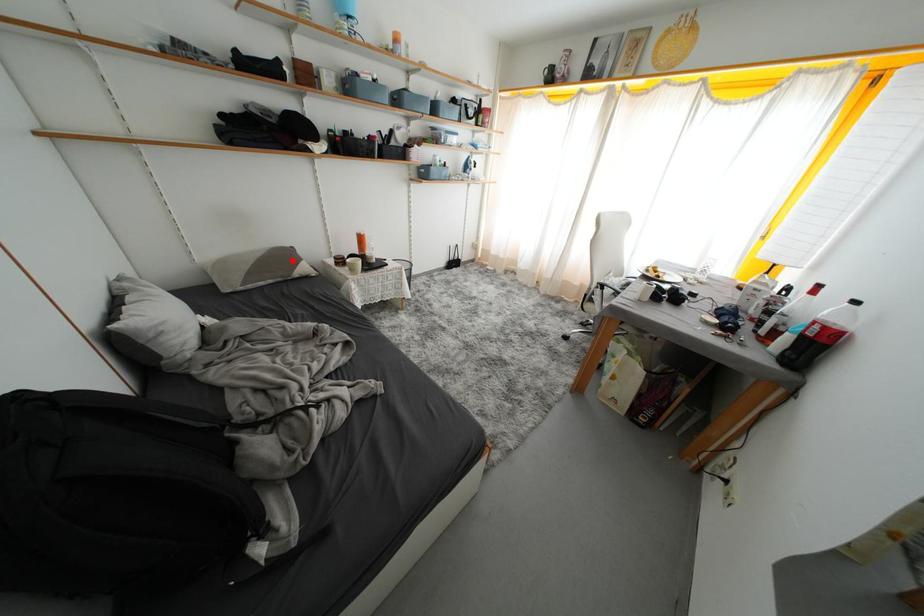
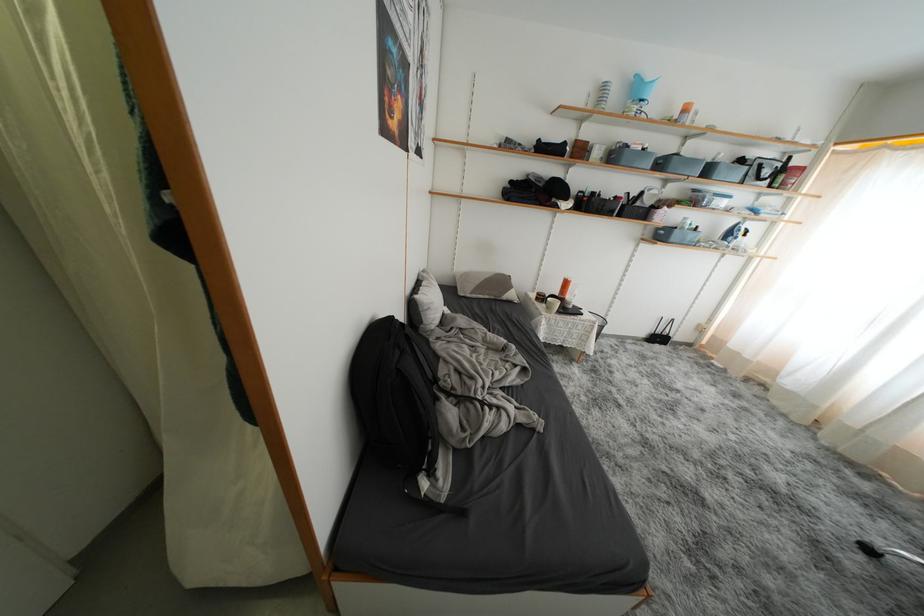
Question: I am providing you with two images of the same scene from different viewpoints. Image1 has a red point marked. In image2, the corresponding 3D location appears at what relative position? Reply with the corresponding letter.

Choices:
 (A) Closer
 (B) Farther

Answer: (B)